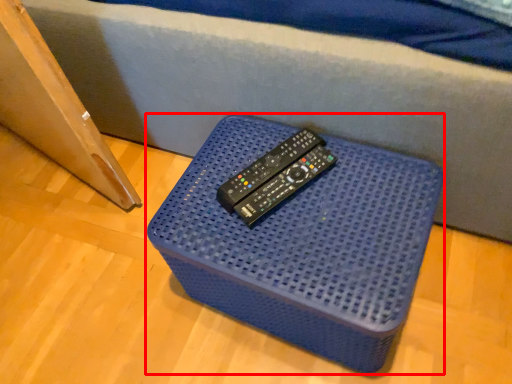
Question: From the image's perspective, where is furniture (annotated by the red box) located in relation to remote in the image?

Choices:
 (A) below
 (B) above

Answer: (A)